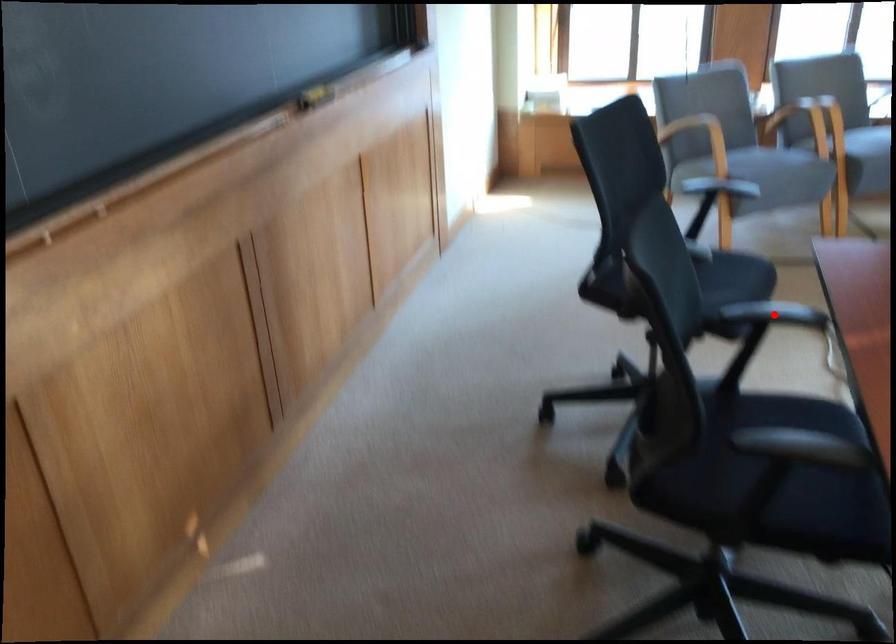
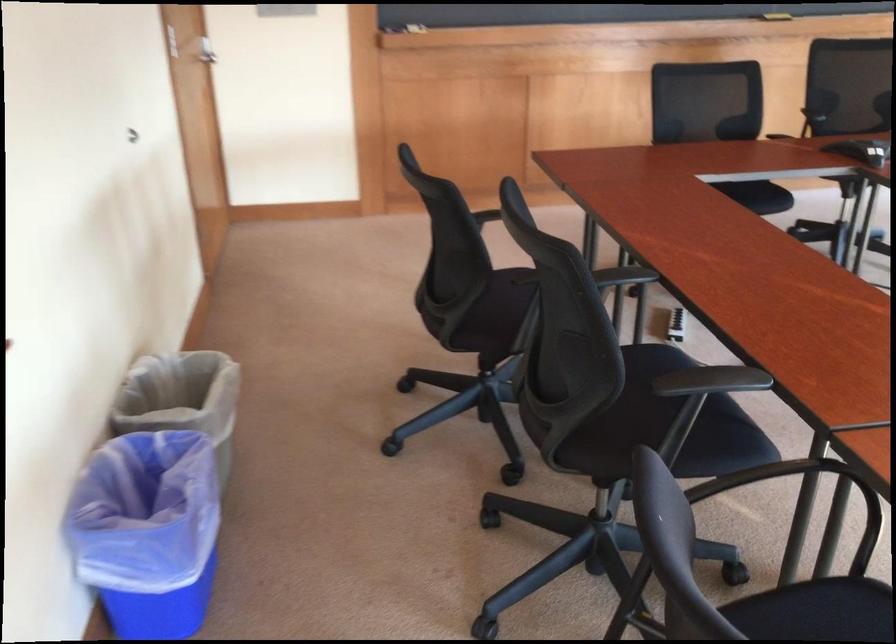
Question: I am providing you with two images of the same scene from different viewpoints. A red point is marked on the first image. Can you still see the location of the red point in image 2?

Choices:
 (A) Yes
 (B) No

Answer: (B)